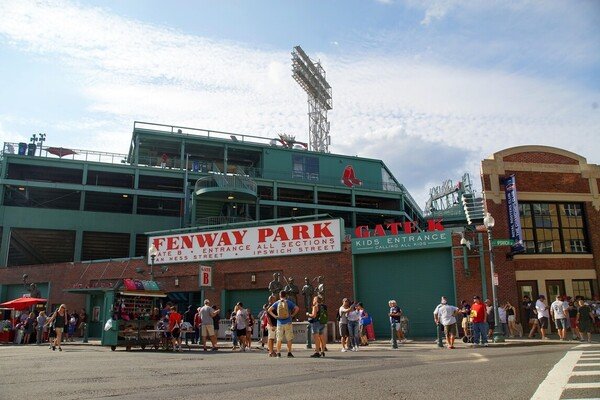
Locate an element on the screen. windows is located at coordinates (574, 224), (544, 217), (525, 228), (579, 295), (526, 292).